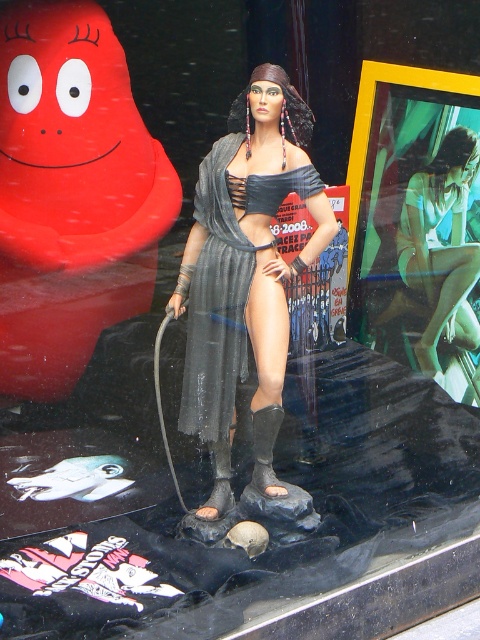
Question: Which point appears closest to the camera in this image?

Choices:
 (A) (222, 157)
 (B) (414, 282)

Answer: (A)

Question: Is matte red rubber at upper left in front of matte green shorts at center?

Choices:
 (A) no
 (B) yes

Answer: (B)

Question: Which point is farther from the camera taking this photo?

Choices:
 (A) (408, 212)
 (B) (12, 202)
 (C) (232, 296)

Answer: (A)

Question: Which point appears farthest from the camera in this image?

Choices:
 (A) (218, 252)
 (B) (477, 392)

Answer: (B)

Question: Can you confirm if matte red rubber at upper left is bigger than gray fabric dress at center?

Choices:
 (A) yes
 (B) no

Answer: (A)

Question: Does gray fabric dress at center appear on the left side of matte green shorts at center?

Choices:
 (A) yes
 (B) no

Answer: (A)